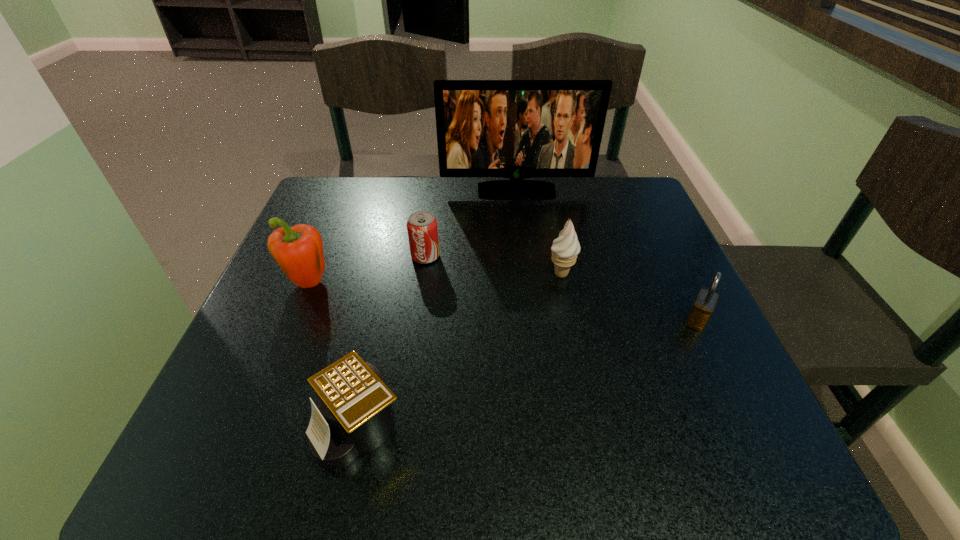
Locate an element on the screen. The image size is (960, 540). padlock at the right edge is located at coordinates (704, 305).

The image size is (960, 540). I want to click on object that is at the far right corner, so click(x=517, y=129).

Identify the location of vacant area at the far edge of the desktop. The width and height of the screenshot is (960, 540). (418, 187).

The width and height of the screenshot is (960, 540). What are the coordinates of `blank space at the near edge` in the screenshot? It's located at (563, 474).

Where is `vacant space at the left edge`? vacant space at the left edge is located at coordinates (280, 299).

Image resolution: width=960 pixels, height=540 pixels. In the image, there is a desktop. Identify the location of vacant space at the right edge. (622, 228).

At what (x,y) coordinates should I click in order to perform the action: click on vacant space at the far right corner of the desktop. Please return your answer as a coordinate pair (x, y). The image size is (960, 540). Looking at the image, I should click on (621, 197).

You are a GUI agent. You are given a task and a screenshot of the screen. Output one action in this format:
    pyautogui.click(x=<x>, y=<y>)
    Task: Click on the blank area at the near right corner
    
    Given the screenshot: What is the action you would take?
    pyautogui.click(x=735, y=452)

Where is `vacant region between the calculator and the soda can`? This screenshot has width=960, height=540. vacant region between the calculator and the soda can is located at coordinates (393, 341).

Where is `free point between the leftmost object and the padlock`? free point between the leftmost object and the padlock is located at coordinates (502, 302).